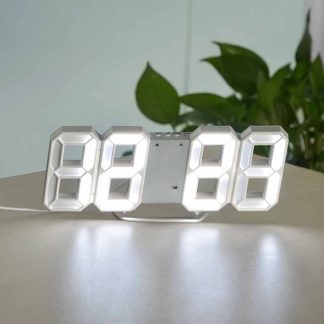
You are a GUI agent. You are given a task and a screenshot of the screen. Output one action in this format:
    pyautogui.click(x=<x>, y=<y>)
    Task: Click on the table surface
    The image size is (324, 324).
    Given the screenshot: What is the action you would take?
    pyautogui.click(x=243, y=240)